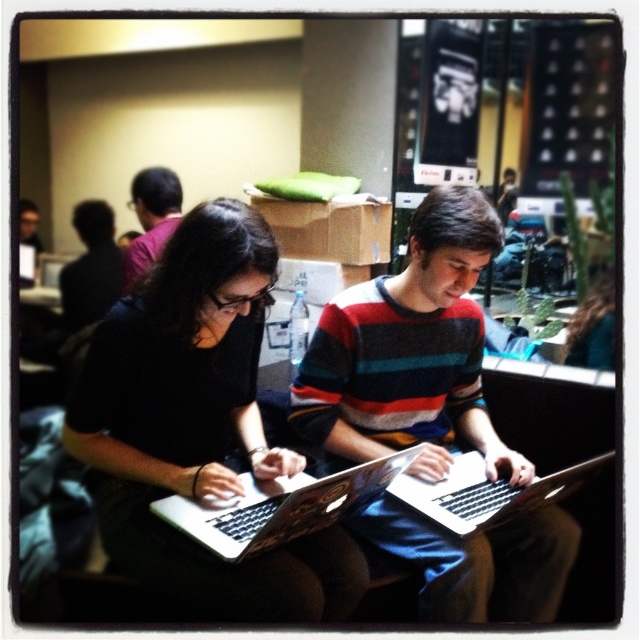
Question: Is silver metallic laptop at center above matte black shirt at left?

Choices:
 (A) no
 (B) yes

Answer: (A)

Question: Which is farther from the matte black laptop at left?

Choices:
 (A) silver metallic laptop at center
 (B) matte black shirt at upper left
 (C) black matte laptop at center
 (D) metallic silver laptop at center

Answer: (A)

Question: Which of the following is the farthest from the observer?

Choices:
 (A) (72, 314)
 (B) (216, 328)

Answer: (A)

Question: Which point is farther from the camera taking this photo?

Choices:
 (A) (180, 365)
 (B) (29, 234)
 (C) (458, 296)

Answer: (B)

Question: Considering the relative positions of matte black shirt at left and matte black laptop at left in the image provided, where is matte black shirt at left located with respect to matte black laptop at left?

Choices:
 (A) below
 (B) above

Answer: (A)

Question: Does black matte laptop at center appear over matte black shirt at upper left?

Choices:
 (A) no
 (B) yes

Answer: (A)